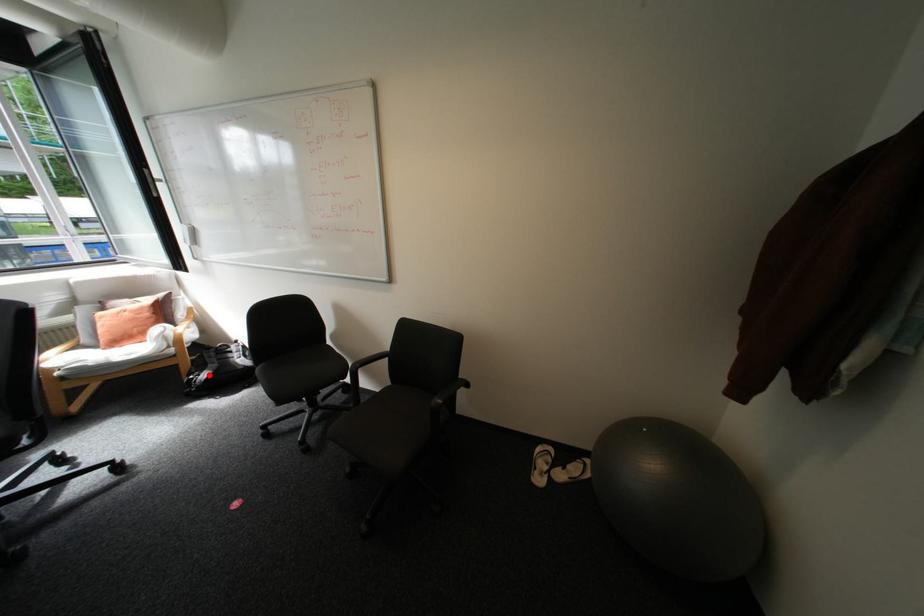
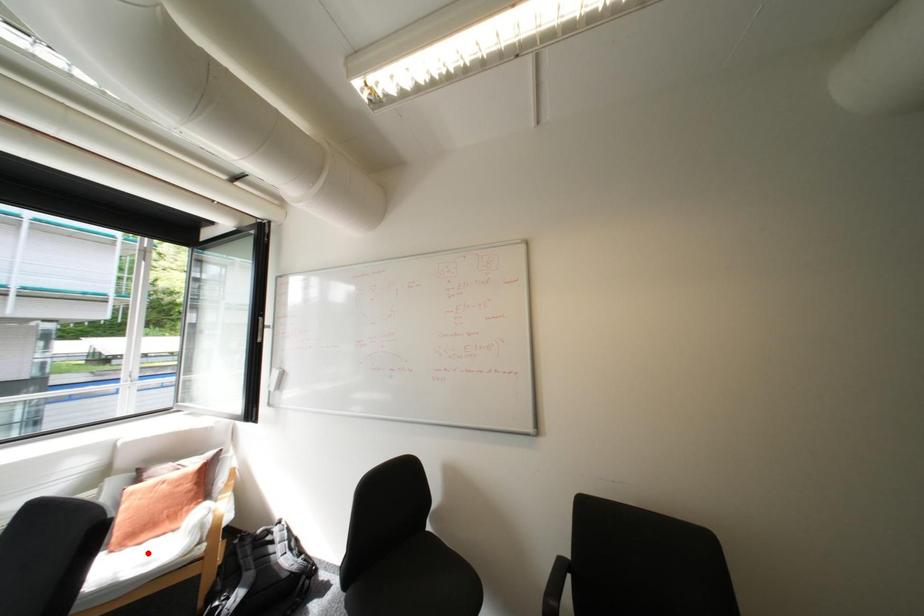
From the picture: I am providing you with two images of the same scene from different viewpoints. A red point is marked on the first image and another point is marked on the second image. Is the marked point in image1 the same physical position as the marked point in image2?

No